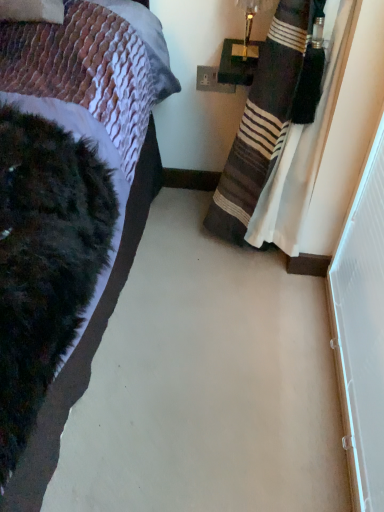
Measure the distance between white plastic screen door at right and camera.

They are 33.23 inches apart.

This screenshot has height=512, width=384. What do you see at coordinates (362, 331) in the screenshot?
I see `white plastic screen door at right` at bounding box center [362, 331].

This screenshot has width=384, height=512. Find the location of `striped fabric curtain at right`. striped fabric curtain at right is located at coordinates (269, 115).

This screenshot has height=512, width=384. Describe the element at coordinates (212, 81) in the screenshot. I see `white plastic power outlet at upper center` at that location.

Where is `white plastic screen door at right`? This screenshot has height=512, width=384. white plastic screen door at right is located at coordinates (362, 331).

Is metallic gold lamp at upper right facing away from striped fabric curtain at right?

That's not correct — metallic gold lamp at upper right is not looking away from striped fabric curtain at right.

Is metallic gold lamp at upper right taller than striped fabric curtain at right?

No, metallic gold lamp at upper right is not taller than striped fabric curtain at right.

In the image, is metallic gold lamp at upper right positioned in front of or behind striped fabric curtain at right?

Visually, metallic gold lamp at upper right is located behind striped fabric curtain at right.

Consider the image. From the image's perspective, does metallic gold lamp at upper right appear lower than striped fabric curtain at right?

No, from the image's perspective, metallic gold lamp at upper right is not below striped fabric curtain at right.

Would you say metallic gold lamp at upper right contains white plastic screen door at right?

No, white plastic screen door at right is not a part of metallic gold lamp at upper right.

Which of these two, metallic gold lamp at upper right or white plastic screen door at right, is thinner?

Thinner between the two is white plastic screen door at right.

Does metallic gold lamp at upper right come behind white plastic screen door at right?

Yes, metallic gold lamp at upper right is further from the viewer.

Is point (252, 52) closer or farther from the camera than point (348, 216)?

Point (252, 52) is farther from the camera than point (348, 216).

Can we say white plastic power outlet at upper center lies outside striped fabric curtain at right?

Yes, white plastic power outlet at upper center is outside of striped fabric curtain at right.

Which object is further away from the camera, white plastic power outlet at upper center or striped fabric curtain at right?

white plastic power outlet at upper center is further away from the camera.

Is white plastic power outlet at upper center bigger than striped fabric curtain at right?

No.

Which is more to the right, metallic gold lamp at upper right or white plastic power outlet at upper center?

metallic gold lamp at upper right.

In the scene shown: Can you confirm if metallic gold lamp at upper right is smaller than white plastic power outlet at upper center?

No, metallic gold lamp at upper right is not smaller than white plastic power outlet at upper center.

Can white plastic power outlet at upper center be found inside metallic gold lamp at upper right?

No.

What are the coordinates of `screen door that appears below the white plastic power outlet at upper center (from a real-world perspective)` in the screenshot? It's located at tap(362, 331).

Is white plastic screen door at right positioned with its back to white plastic power outlet at upper center?

No, white plastic screen door at right is not facing the opposite direction of white plastic power outlet at upper center.

Does white plastic screen door at right have a greater height compared to white plastic power outlet at upper center?

Yes, white plastic screen door at right is taller than white plastic power outlet at upper center.

Is white plastic screen door at right further to camera compared to white plastic power outlet at upper center?

No, it is in front of white plastic power outlet at upper center.

Based on the photo, how far apart are striped fabric curtain at right and white plastic screen door at right?

striped fabric curtain at right and white plastic screen door at right are 16.52 inches apart from each other.

Is striped fabric curtain at right far from white plastic screen door at right?

striped fabric curtain at right is near white plastic screen door at right, not far away.

In the image, is striped fabric curtain at right on the left side or the right side of white plastic screen door at right?

striped fabric curtain at right is positioned on white plastic screen door at right's left side.

Is striped fabric curtain at right inside or outside of white plastic screen door at right?

striped fabric curtain at right is not inside white plastic screen door at right, it's outside.

Where is `curtain below the metallic gold lamp at upper right (from the image's perspective)`? curtain below the metallic gold lamp at upper right (from the image's perspective) is located at coordinates (269, 115).

From the image's perspective, who appears lower, striped fabric curtain at right or metallic gold lamp at upper right?

From the image's view, striped fabric curtain at right is below.

In the image, is striped fabric curtain at right positioned in front of or behind metallic gold lamp at upper right?

In the image, striped fabric curtain at right appears in front of metallic gold lamp at upper right.

From a real-world perspective, is striped fabric curtain at right above or below metallic gold lamp at upper right?

Clearly, from a real-world perspective, striped fabric curtain at right is below metallic gold lamp at upper right.

Where is `curtain that is in front of the metallic gold lamp at upper right`? curtain that is in front of the metallic gold lamp at upper right is located at coordinates (269, 115).

Where is `lamp lying above the white plastic screen door at right (from the image's perspective)`? The image size is (384, 512). lamp lying above the white plastic screen door at right (from the image's perspective) is located at coordinates (247, 30).

Considering their positions, is white plastic power outlet at upper center positioned further to metallic gold lamp at upper right than white plastic screen door at right?

white plastic screen door at right lies further to metallic gold lamp at upper right than the other object.

Considering their positions, is white plastic power outlet at upper center positioned closer to striped fabric curtain at right than metallic gold lamp at upper right?

metallic gold lamp at upper right lies closer to striped fabric curtain at right than the other object.

Which object lies nearer to the anchor point white plastic screen door at right, metallic gold lamp at upper right or white plastic power outlet at upper center?

metallic gold lamp at upper right lies closer to white plastic screen door at right than the other object.

Estimate the real-world distances between objects in this image. Which object is closer to metallic gold lamp at upper right, white plastic screen door at right or white plastic power outlet at upper center?

Based on the image, white plastic power outlet at upper center appears to be nearer to metallic gold lamp at upper right.

From the image, which object appears to be nearer to white plastic screen door at right, white plastic power outlet at upper center or metallic gold lamp at upper right?

The object closer to white plastic screen door at right is metallic gold lamp at upper right.

When comparing their distances from white plastic power outlet at upper center, does white plastic screen door at right or striped fabric curtain at right seem closer?

The object closer to white plastic power outlet at upper center is striped fabric curtain at right.

Which object lies further to the anchor point white plastic screen door at right, striped fabric curtain at right or white plastic power outlet at upper center?

white plastic power outlet at upper center.

Which object lies further to the anchor point metallic gold lamp at upper right, striped fabric curtain at right or white plastic power outlet at upper center?

striped fabric curtain at right is positioned further to the anchor metallic gold lamp at upper right.

Where is `lamp between striped fabric curtain at right and white plastic power outlet at upper center along the z-axis`? This screenshot has height=512, width=384. lamp between striped fabric curtain at right and white plastic power outlet at upper center along the z-axis is located at coordinates (247, 30).

This screenshot has height=512, width=384. I want to click on curtain that lies between metallic gold lamp at upper right and white plastic screen door at right from top to bottom, so click(269, 115).

Locate an element on the screen. curtain positioned between white plastic screen door at right and white plastic power outlet at upper center from near to far is located at coordinates (269, 115).

Where is `power outlet between metallic gold lamp at upper right and white plastic screen door at right in the vertical direction`? power outlet between metallic gold lamp at upper right and white plastic screen door at right in the vertical direction is located at coordinates (212, 81).